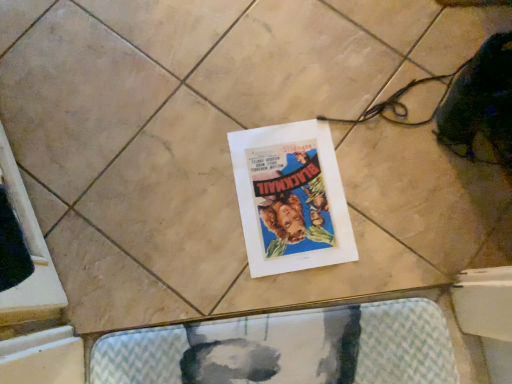
The height and width of the screenshot is (384, 512). I want to click on vacant region to the left of matte paper comic book at center, so click(180, 199).